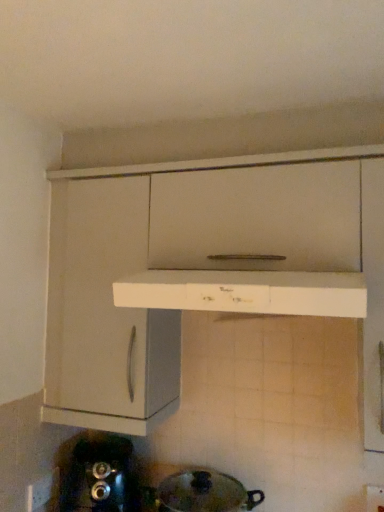
The width and height of the screenshot is (384, 512). Describe the element at coordinates (246, 292) in the screenshot. I see `white matte range hood at center` at that location.

In order to click on white matte range hood at center in this screenshot , I will do `click(246, 292)`.

The image size is (384, 512). I want to click on white matte range hood at center, so click(x=246, y=292).